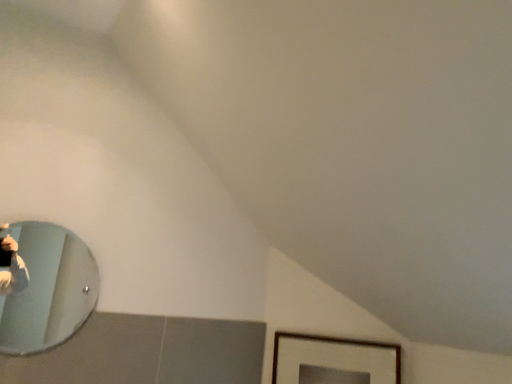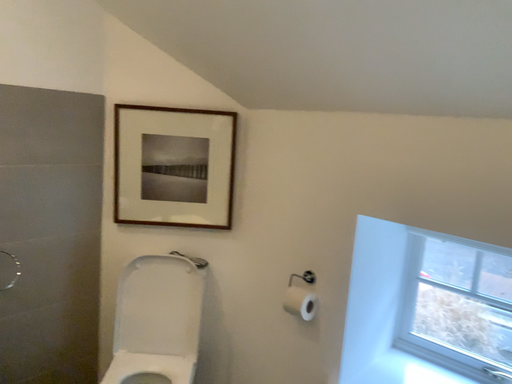
Question: Which way did the camera rotate in the video?

Choices:
 (A) rotated left
 (B) rotated right

Answer: (B)